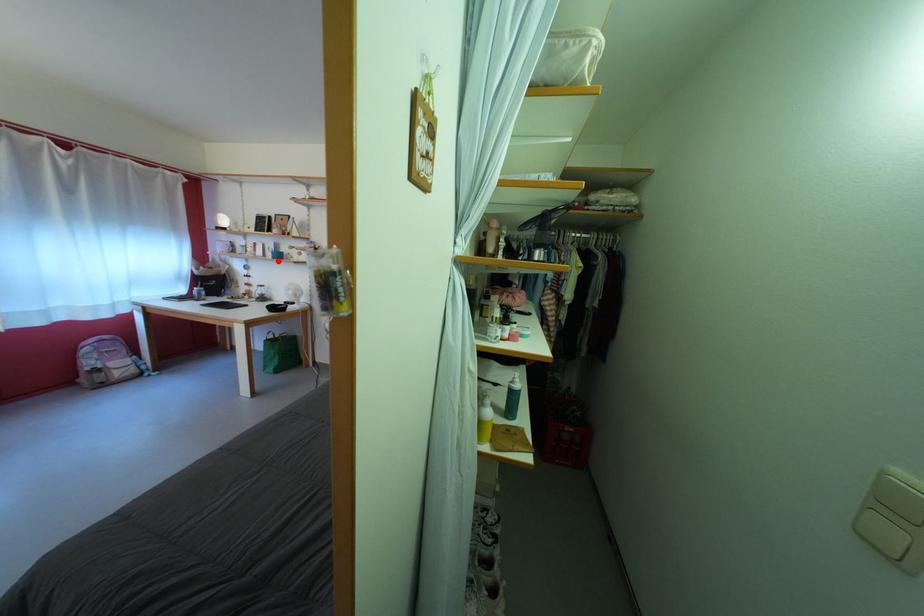
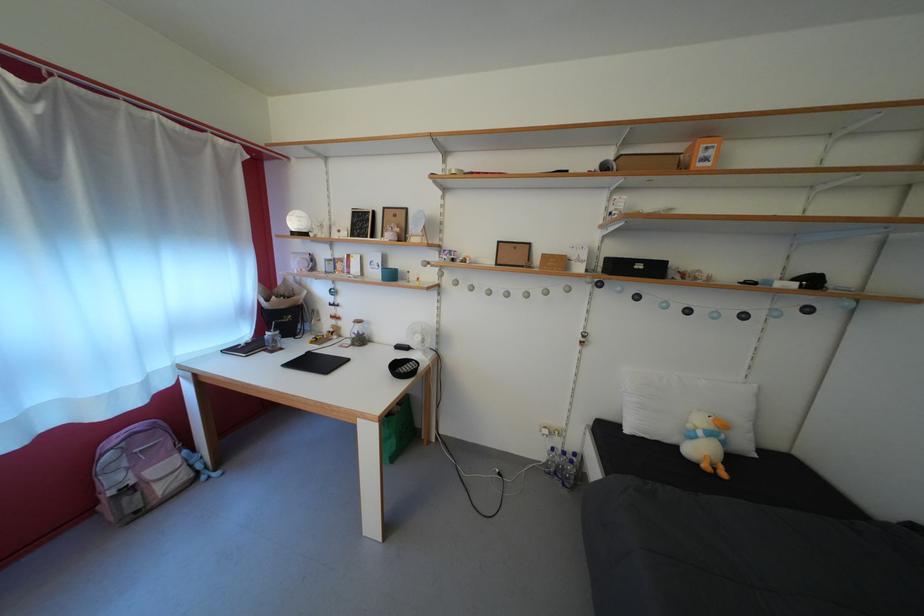
Question: I am providing you with two images of the same scene from different viewpoints. In image1, a red point is highlighted. Considering the same 3D point in image2, which of the following is correct?

Choices:
 (A) It is closer
 (B) It is farther

Answer: (A)